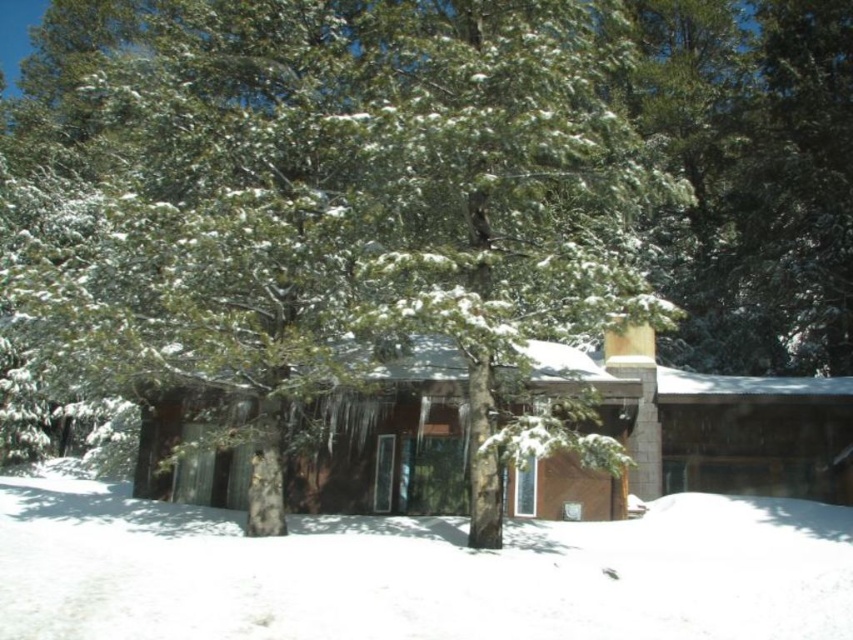
You are planning to build a snowman using the white fluffy snow at lower center near the brown wood cabin at center. Considering the size of the snow, will you have enough snow to make a medium sized snowman?

The white fluffy snow at lower center is smaller than the brown wood cabin at center. Since the snow pile is smaller than the cabin, it might not be sufficient to build a medium sized snowman which typically requires a larger amount of snow. You may need to gather more snow from other areas.

You are standing at the center of the image and want to place a small red flag exactly at the white fluffy snow at lower center. What are the coordinates where you should place the flag?

The coordinates for the white fluffy snow at lower center are at point [416,572], so you should place the flag there.

You are planning to build a snowman using the white fluffy snow at lower center near the brown wood cabin at center. Considering the amount of snow available, will you have enough snow to build a medium sized snowman?

The white fluffy snow at lower center is thinner than the brown wood cabin at center, so there might not be enough snow to build a medium sized snowman since the snow layer is thinner compared to the cabin.